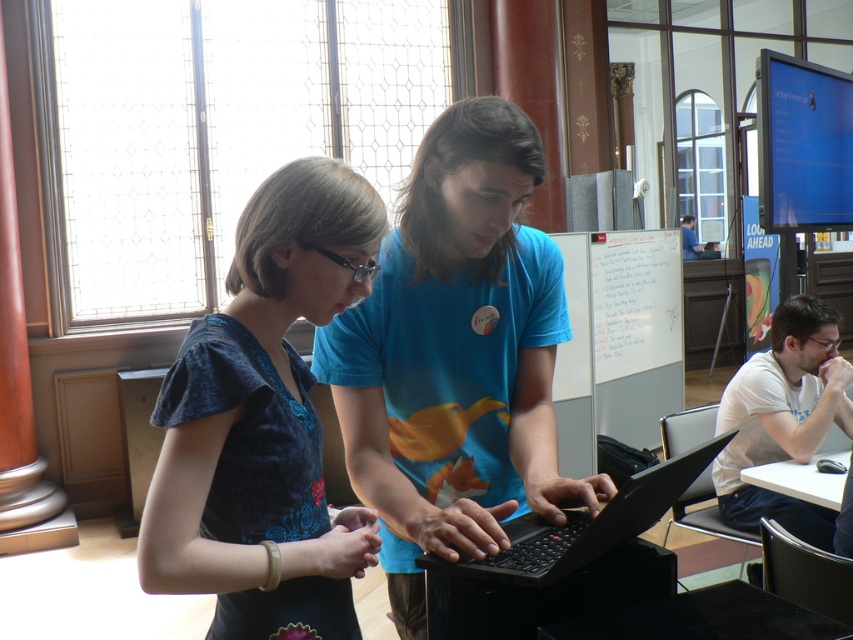
Is the position of blue matte shirt at center more distant than that of whiteboard at center?

No, blue matte shirt at center is in front of whiteboard at center.

Which is in front, point (480, 497) or point (573, 369)?

Positioned in front is point (480, 497).

At what (x,y) coordinates should I click in order to perform the action: click on blue matte shirt at center. Please return your answer as a coordinate pair (x, y). Image resolution: width=853 pixels, height=640 pixels. Looking at the image, I should click on (456, 356).

Locate an element on the screen. This screenshot has width=853, height=640. blue matte shirt at center is located at coordinates (456, 356).

Who is positioned more to the right, blue matte shirt at center or black matte laptop at center?

Positioned to the right is black matte laptop at center.

Based on the photo, between blue matte shirt at center and black matte laptop at center, which one is positioned higher?

Positioned higher is blue matte shirt at center.

Which is behind, point (341, 404) or point (567, 561)?

The point (341, 404) is more distant.

At what (x,y) coordinates should I click in order to perform the action: click on blue matte shirt at center. Please return your answer as a coordinate pair (x, y). Image resolution: width=853 pixels, height=640 pixels. Looking at the image, I should click on (456, 356).

Does whiteboard at center have a greater width compared to black matte laptop at center?

Correct, the width of whiteboard at center exceeds that of black matte laptop at center.

Is whiteboard at center bigger than black matte laptop at center?

Yes, whiteboard at center is bigger than black matte laptop at center.

Where is `whiteboard at center`? whiteboard at center is located at coordinates (618, 340).